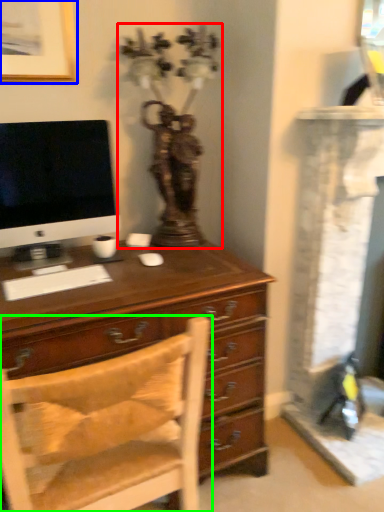
Question: Which object is the farthest from antique (highlighted by a red box)? Choose among these: picture frame (highlighted by a blue box) or chair (highlighted by a green box).

Choices:
 (A) picture frame
 (B) chair

Answer: (B)